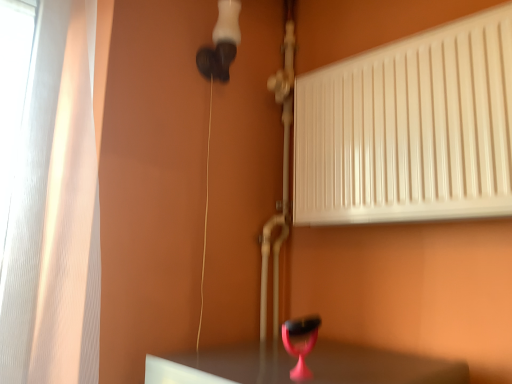
Question: Should I look upward or downward to see pink plastic table lamp at lower center?

Choices:
 (A) down
 (B) up

Answer: (A)

Question: Can we say white glossy radiator at upper right lies outside pink plastic table lamp at lower center?

Choices:
 (A) no
 (B) yes

Answer: (B)

Question: From the image's perspective, is white glossy radiator at upper right over pink plastic table lamp at lower center?

Choices:
 (A) yes
 (B) no

Answer: (A)

Question: Is white glossy radiator at upper right shorter than pink plastic table lamp at lower center?

Choices:
 (A) no
 (B) yes

Answer: (A)

Question: Is white glossy radiator at upper right not close to pink plastic table lamp at lower center?

Choices:
 (A) no
 (B) yes

Answer: (A)

Question: Can you confirm if white glossy radiator at upper right is positioned to the left of pink plastic table lamp at lower center?

Choices:
 (A) no
 (B) yes

Answer: (A)

Question: Is white glossy radiator at upper right bigger than pink plastic table lamp at lower center?

Choices:
 (A) yes
 (B) no

Answer: (A)

Question: Does pink plastic table lamp at lower center have a lesser height compared to white glossy radiator at upper right?

Choices:
 (A) yes
 (B) no

Answer: (A)

Question: Is pink plastic table lamp at lower center thinner than white glossy radiator at upper right?

Choices:
 (A) yes
 (B) no

Answer: (A)

Question: Does pink plastic table lamp at lower center have a larger size compared to white glossy radiator at upper right?

Choices:
 (A) yes
 (B) no

Answer: (B)

Question: Is pink plastic table lamp at lower center next to white glossy radiator at upper right and touching it?

Choices:
 (A) yes
 (B) no

Answer: (B)

Question: Is pink plastic table lamp at lower center looking in the opposite direction of white glossy radiator at upper right?

Choices:
 (A) yes
 (B) no

Answer: (B)

Question: Is pink plastic table lamp at lower center smaller than white glossy radiator at upper right?

Choices:
 (A) yes
 (B) no

Answer: (A)

Question: Considering the positions of white glossy radiator at upper right and pink plastic table lamp at lower center in the image, is white glossy radiator at upper right bigger or smaller than pink plastic table lamp at lower center?

Choices:
 (A) small
 (B) big

Answer: (B)